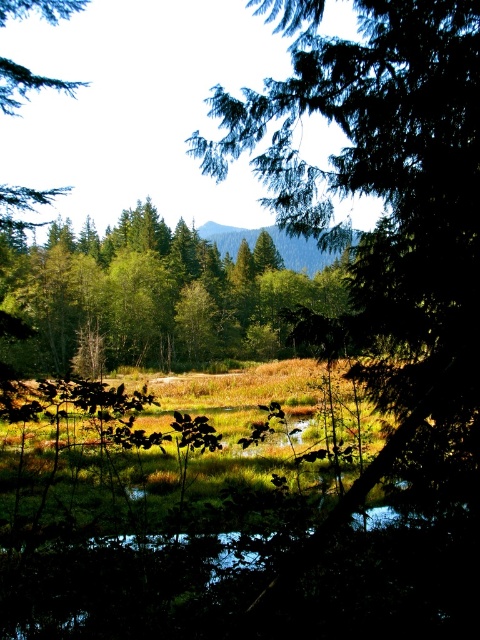
Question: Which point is closer to the camera taking this photo?

Choices:
 (A) (434, 488)
 (B) (71, 339)

Answer: (A)

Question: Which point is farther to the camera?

Choices:
 (A) green leafy tree at center
 (B) green matte tree at center

Answer: (A)

Question: Observing the image, what is the correct spatial positioning of green matte tree at center in reference to green leafy tree at center?

Choices:
 (A) left
 (B) right

Answer: (B)

Question: Is green matte tree at center above green leafy tree at center?

Choices:
 (A) no
 (B) yes

Answer: (A)

Question: From the image, what is the correct spatial relationship of green matte tree at center in relation to green leafy tree at center?

Choices:
 (A) right
 (B) left

Answer: (A)

Question: Which point is farther to the camera?

Choices:
 (A) green matte tree at center
 (B) green leafy tree at center

Answer: (B)